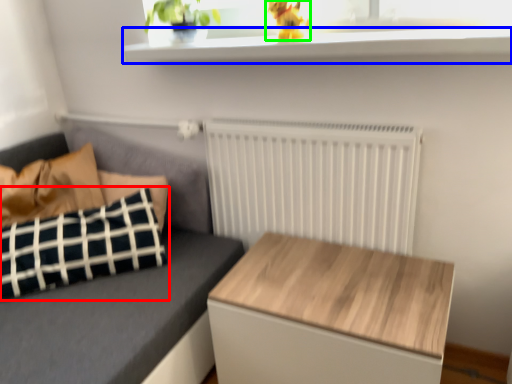
Question: Which object is positioned farthest from pillow (highlighted by a red box)? Select from window sill (highlighted by a blue box) and animal (highlighted by a green box).

Choices:
 (A) window sill
 (B) animal

Answer: (B)